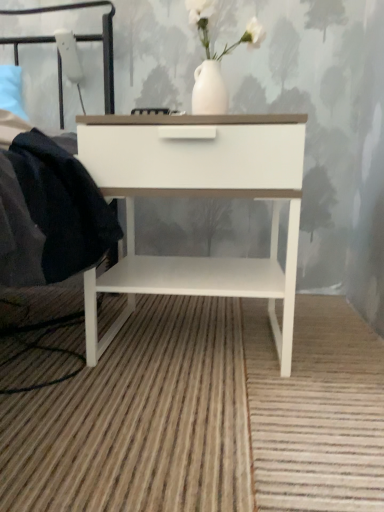
This screenshot has width=384, height=512. What are the coordinates of `free point to the left of white glossy nightstand at center` in the screenshot? It's located at (46, 344).